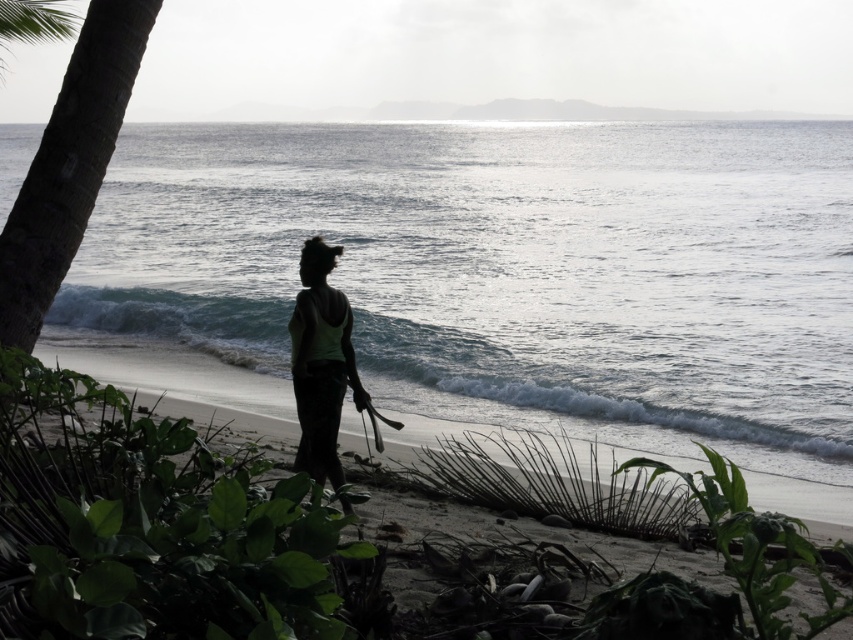
You are a botanist examining the plants in the beach scene. Based on their positions and the available space, can you determine if the green leafy plant at center could potentially block the view of the brown rough palm tree at left from where you are standing?

The green leafy plant at center is wider than brown rough palm tree at left, so it might block the view of the brown rough palm tree at left depending on their exact positions and angles.

You are a photographer trying to capture the glistening silver water at center and the brown rough palm tree at left in a single frame. Based on their positions, which object would appear closer to the camera in the photo?

The glistening silver water at center appears closer to the camera because it is positioned above the brown rough palm tree at left, indicating it is in the foreground.

You are a photographer trying to capture the silhouette fabric woman at center and the glistening silver water at center in a single shot. Which object should you focus on first to ensure both are in frame?

You should focus on the silhouette fabric woman at center first because it is closer to you than the glistening silver water at center, ensuring both are in frame.